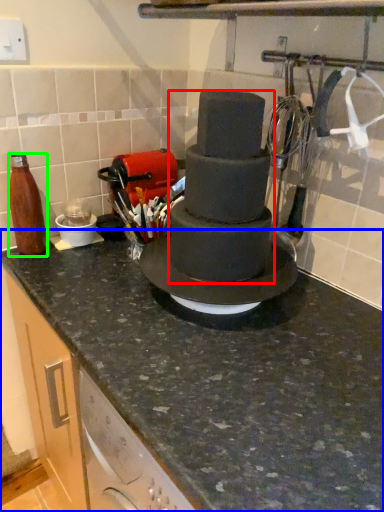
Question: Which object is positioned closest to chocolate cake (highlighted by a red box)? Select from countertop (highlighted by a blue box) and bottle (highlighted by a green box).

Choices:
 (A) countertop
 (B) bottle

Answer: (A)